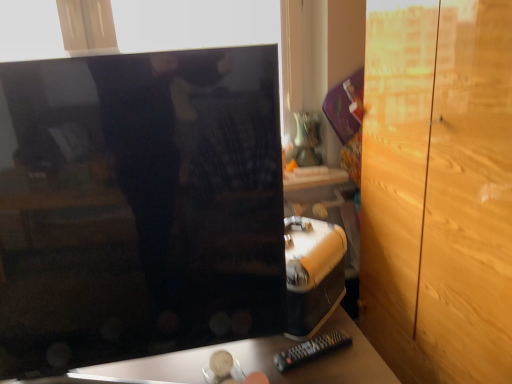
Question: Is point (307, 354) positioned closer to the camera than point (184, 355)?

Choices:
 (A) closer
 (B) farther

Answer: (B)

Question: From the image's perspective, is black plastic remote at lower center positioned above or below matte black tv at center?

Choices:
 (A) below
 (B) above

Answer: (B)

Question: Estimate the real-world distances between objects in this image. Which object is farther from the black plastic remote at lower center?

Choices:
 (A) matte black tv at center
 (B) glossy black monitor at center
 (C) light brown wood dresser at right

Answer: (C)

Question: Based on their relative distances, which object is farther from the black plastic remote at lower center?

Choices:
 (A) matte black tv at center
 (B) glossy black monitor at center
 (C) light brown wood dresser at right

Answer: (C)